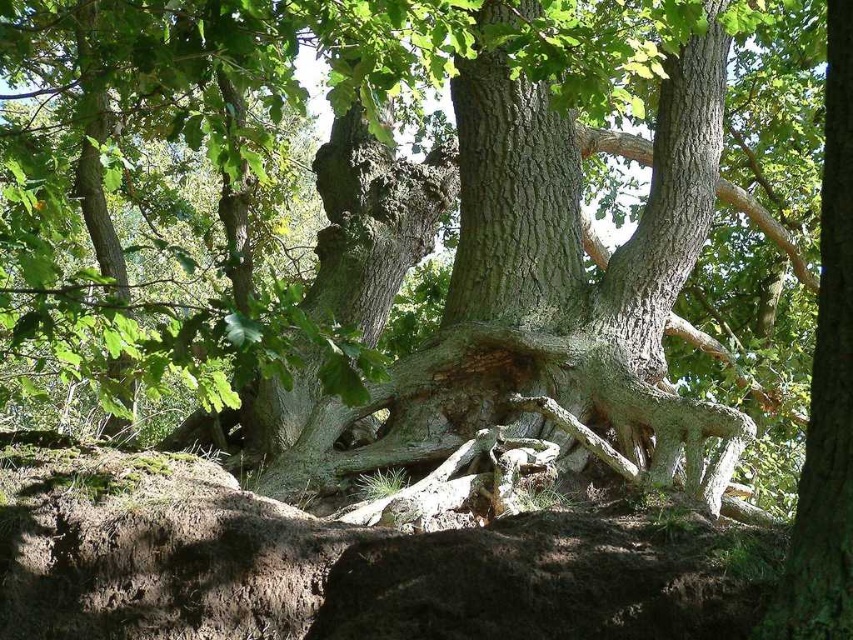
Does brown rough rock at lower center appear on the left side of green rough bark tree trunk at center?

Yes, brown rough rock at lower center is to the left of green rough bark tree trunk at center.

Is point (161, 536) farther from viewer compared to point (822, 458)?

Yes.

Identify the location of brown rough rock at lower center. The image size is (853, 640). (331, 563).